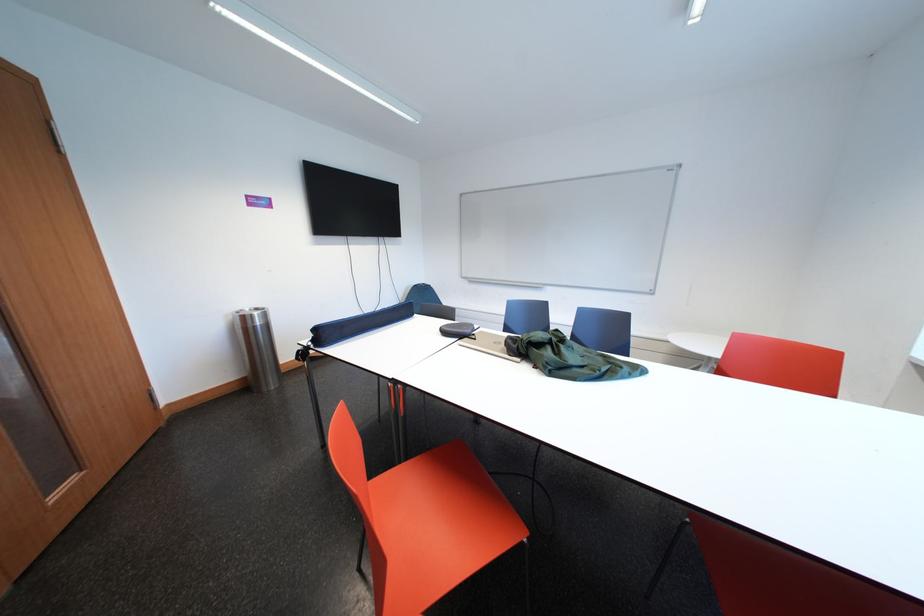
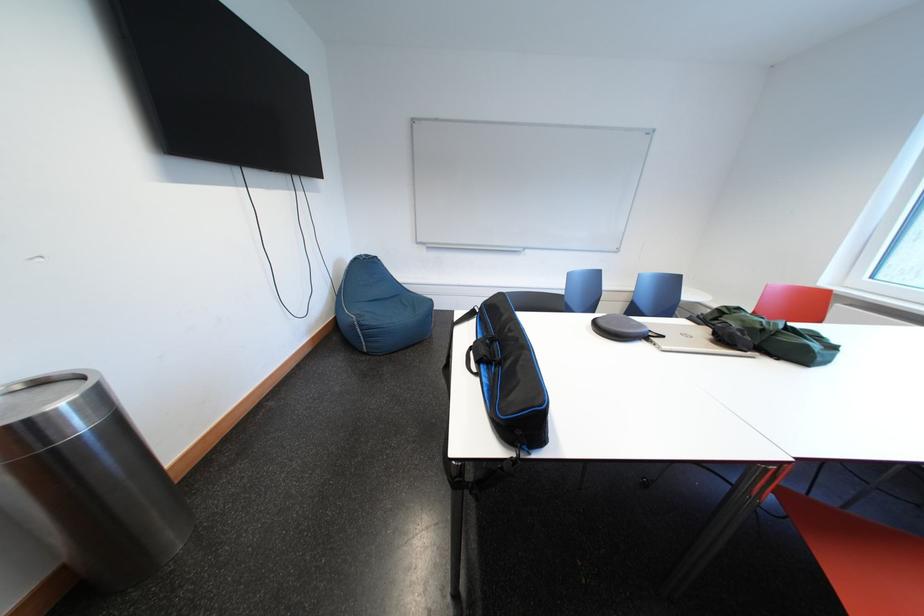
Locate, in the second image, the point that corresponds to [254,323] in the first image.

(30, 439)